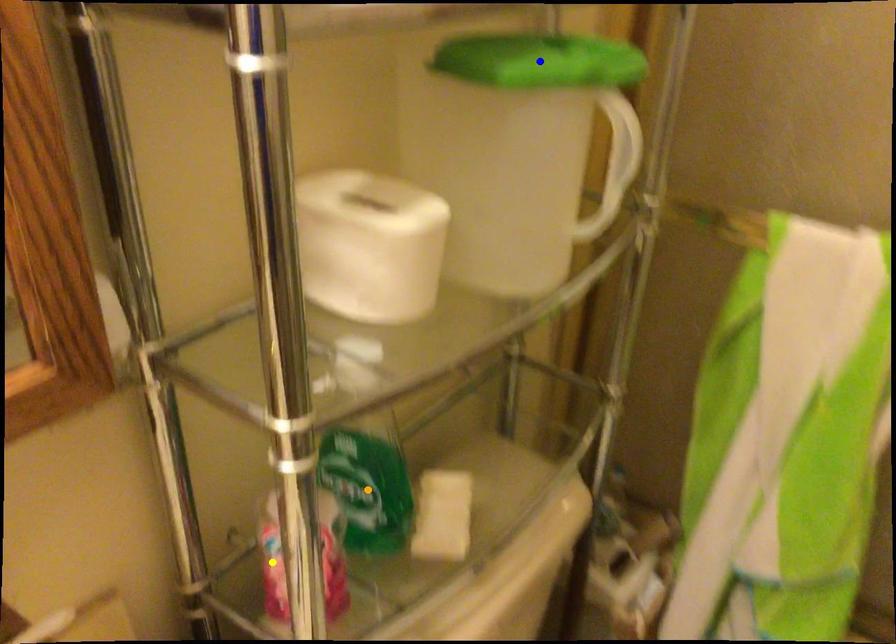
Order these from nearest to farthest:
orange point
yellow point
blue point

blue point → orange point → yellow point